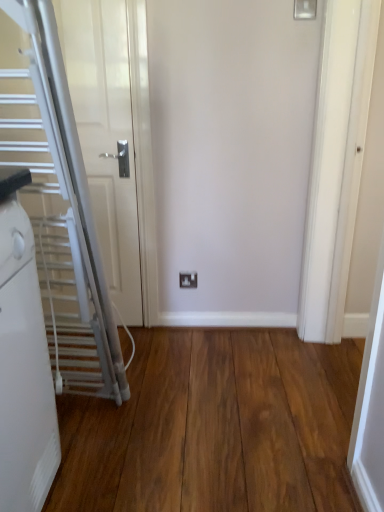
Question: From a real-world perspective, is wooden floor at center positioned over white plastic electric outlet at center based on gravity?

Choices:
 (A) no
 (B) yes

Answer: (A)

Question: From a real-world perspective, is wooden floor at center below white plastic electric outlet at center?

Choices:
 (A) yes
 (B) no

Answer: (A)

Question: Can you confirm if wooden floor at center is positioned to the left of white plastic electric outlet at center?

Choices:
 (A) yes
 (B) no

Answer: (A)

Question: Is there a large distance between wooden floor at center and white plastic electric outlet at center?

Choices:
 (A) yes
 (B) no

Answer: (B)

Question: From the image's perspective, is wooden floor at center on white plastic electric outlet at center?

Choices:
 (A) no
 (B) yes

Answer: (A)

Question: From the image's perspective, is white plastic electric outlet at center located above or below wooden floor at center?

Choices:
 (A) below
 (B) above

Answer: (B)

Question: In terms of height, does white plastic electric outlet at center look taller or shorter compared to wooden floor at center?

Choices:
 (A) short
 (B) tall

Answer: (B)

Question: Is white plastic electric outlet at center inside or outside of wooden floor at center?

Choices:
 (A) inside
 (B) outside

Answer: (B)

Question: Is white plastic electric outlet at center wider or thinner than wooden floor at center?

Choices:
 (A) thin
 (B) wide

Answer: (A)

Question: Considering the positions of white plastic electric outlet at center and silver metallic escalator at left in the image, is white plastic electric outlet at center wider or thinner than silver metallic escalator at left?

Choices:
 (A) thin
 (B) wide

Answer: (A)

Question: Considering the positions of white plastic electric outlet at center and silver metallic escalator at left in the image, is white plastic electric outlet at center taller or shorter than silver metallic escalator at left?

Choices:
 (A) tall
 (B) short

Answer: (B)

Question: From a real-world perspective, is white plastic electric outlet at center physically located above or below silver metallic escalator at left?

Choices:
 (A) above
 (B) below

Answer: (B)

Question: Relative to silver metallic escalator at left, is white plastic electric outlet at center in front or behind?

Choices:
 (A) front
 (B) behind

Answer: (B)

Question: Is wooden floor at center wider or thinner than white plastic electric outlet at center?

Choices:
 (A) thin
 (B) wide

Answer: (B)

Question: From the image's perspective, is wooden floor at center positioned above or below white plastic electric outlet at center?

Choices:
 (A) below
 (B) above

Answer: (A)